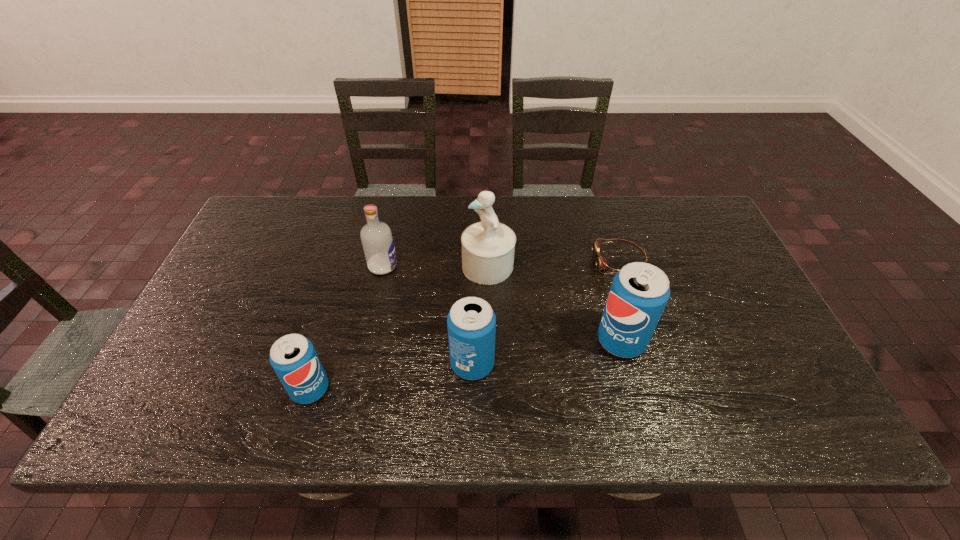
You are a GUI agent. You are given a task and a screenshot of the screen. Output one action in this format:
    pyautogui.click(x=<x>, y=<y>)
    Task: Click on the vacant space that satisfies the following two spatial constraints: 1. on the label of the vodka; 2. on the right side of the rightmost soda can
    This screenshot has width=960, height=540.
    Given the screenshot: What is the action you would take?
    pyautogui.click(x=367, y=341)